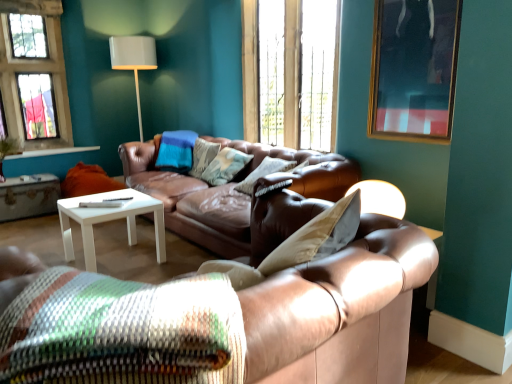
Question: From the image's perspective, is brown leather couch at center, the first studio couch positioned from the back, on top of textured brown pillow at center, which is the second pillow from back to front?

Choices:
 (A) yes
 (B) no

Answer: (B)

Question: Considering the relative sizes of brown leather couch at center, the first studio couch positioned from the back, and textured brown pillow at center, which is the second pillow from back to front, in the image provided, is brown leather couch at center, the first studio couch positioned from the back, thinner than textured brown pillow at center, which is the second pillow from back to front,?

Choices:
 (A) no
 (B) yes

Answer: (A)

Question: Would you consider brown leather couch at center, the second studio couch from the front, to be distant from textured brown pillow at center, arranged as the second pillow when viewed from the front?

Choices:
 (A) yes
 (B) no

Answer: (B)

Question: Can you confirm if brown leather couch at center, the first studio couch positioned from the back, is taller than textured brown pillow at center, arranged as the second pillow when viewed from the front?

Choices:
 (A) yes
 (B) no

Answer: (A)

Question: Is brown leather couch at center, the second studio couch from the front, next to textured brown pillow at center, arranged as the second pillow when viewed from the front?

Choices:
 (A) yes
 (B) no

Answer: (B)

Question: Is brown leather couch at center, the first studio couch positioned from the back, not inside textured brown pillow at center, arranged as the second pillow when viewed from the front?

Choices:
 (A) no
 (B) yes

Answer: (B)

Question: Is textured woven pillow at center, which is the third pillow from back to front, surrounded by textured brown pillow at center, arranged as the second pillow when viewed from the front?

Choices:
 (A) no
 (B) yes

Answer: (A)

Question: Does textured brown pillow at center, which is the second pillow from back to front, have a smaller size compared to textured woven pillow at center, arranged as the 1th pillow when viewed from the front?

Choices:
 (A) no
 (B) yes

Answer: (B)

Question: From the image's perspective, is textured brown pillow at center, arranged as the second pillow when viewed from the front, below textured woven pillow at center, arranged as the 1th pillow when viewed from the front?

Choices:
 (A) no
 (B) yes

Answer: (A)

Question: Is textured brown pillow at center, arranged as the second pillow when viewed from the front, placed right next to textured woven pillow at center, which is the third pillow from back to front?

Choices:
 (A) no
 (B) yes

Answer: (A)

Question: From a real-world perspective, does textured brown pillow at center, which is the second pillow from back to front, stand above textured woven pillow at center, which is the third pillow from back to front?

Choices:
 (A) yes
 (B) no

Answer: (B)

Question: From the image's perspective, would you say textured brown pillow at center, arranged as the second pillow when viewed from the front, is positioned over textured woven pillow at center, which is the third pillow from back to front?

Choices:
 (A) yes
 (B) no

Answer: (A)

Question: Is the depth of glass pane window at upper left, the 1th window from the left, greater than that of textured brown pillow at center, which is the second pillow from back to front?

Choices:
 (A) no
 (B) yes

Answer: (B)